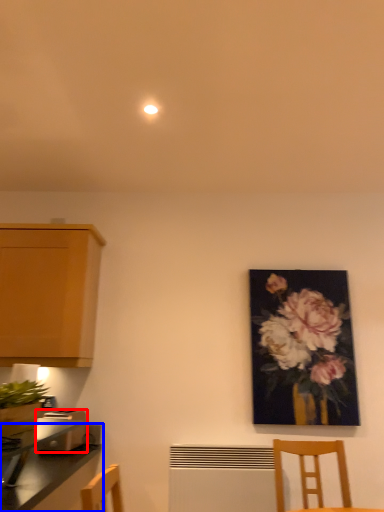
Question: Which object appears closest to the camera in this image, toaster (highlighted by a red box) or countertop (highlighted by a blue box)?

Choices:
 (A) toaster
 (B) countertop

Answer: (B)